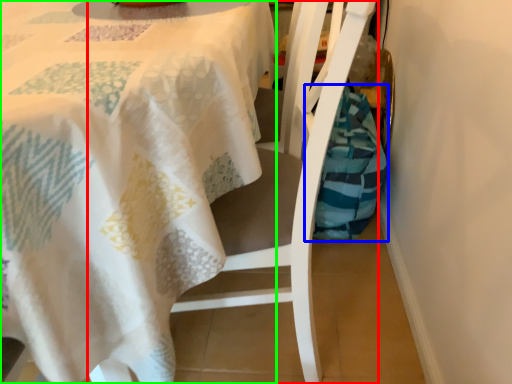
Question: Estimate the real-world distances between objects in this image. Which object is farther from chair (highlighted by a red box), material (highlighted by a blue box) or tablecloth (highlighted by a green box)?

Choices:
 (A) material
 (B) tablecloth

Answer: (A)